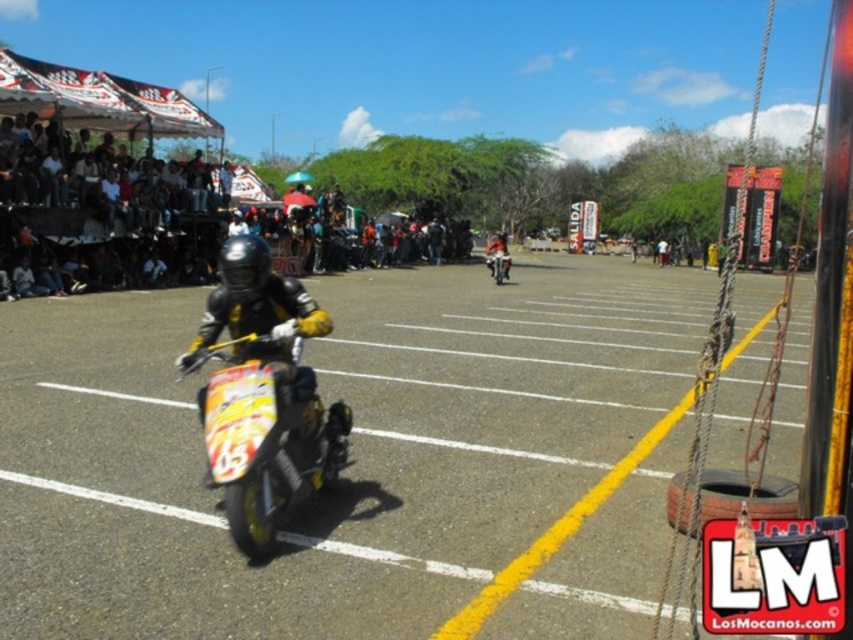
Question: Is yellow asphalt at center thinner than yellow matte motorcycle at center?

Choices:
 (A) no
 (B) yes

Answer: (A)

Question: Does yellow asphalt at center appear over dark clothing crowd at upper left?

Choices:
 (A) no
 (B) yes

Answer: (A)

Question: Which object is positioned farthest from the dark clothing crowd at upper left?

Choices:
 (A) yellow matte motorcycle at center
 (B) yellow asphalt at center
 (C) yellow and black plastic motorbike at center

Answer: (C)

Question: Is dark clothing crowd at upper left behind yellow and black plastic motorbike at center?

Choices:
 (A) no
 (B) yes

Answer: (B)

Question: Which point is closer to the camera?

Choices:
 (A) yellow matte motorcycle at center
 (B) yellow and black plastic motorbike at center
 (C) yellow asphalt at center
 (D) dark clothing crowd at upper left

Answer: (C)

Question: Among these points, which one is farthest from the camera?

Choices:
 (A) (491, 260)
 (B) (213, 404)

Answer: (A)